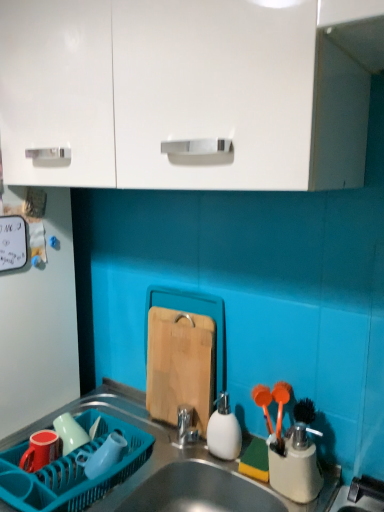
The width and height of the screenshot is (384, 512). I want to click on vacant area on the back side of translucent blue plastic cup at lower left, arranged as the 2th tableware when viewed from the right, so click(x=121, y=436).